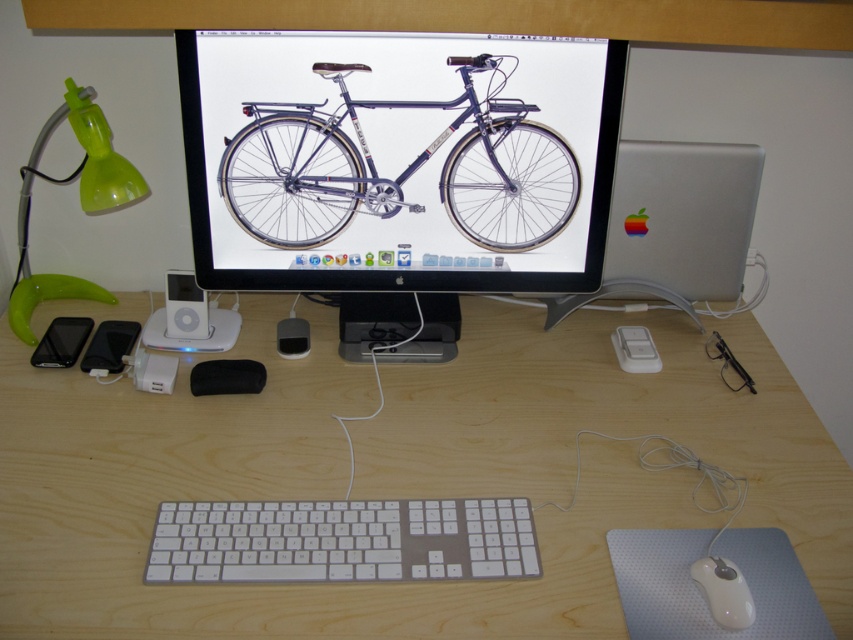
Consider the image. Between green translucent lamp at left and white glossy ipod at center, which one is positioned higher?

green translucent lamp at left

What do you see at coordinates (80, 204) in the screenshot? I see `green translucent lamp at left` at bounding box center [80, 204].

The height and width of the screenshot is (640, 853). What are the coordinates of `green translucent lamp at left` in the screenshot? It's located at coord(80,204).

Between white plastic keyboard at center and black matte phone at lower left, which one has less height?

white plastic keyboard at center is shorter.

At what (x,y) coordinates should I click in order to perform the action: click on white plastic keyboard at center. Please return your answer as a coordinate pair (x, y). The image size is (853, 640). Looking at the image, I should click on (341, 540).

I want to click on white plastic keyboard at center, so click(341, 540).

Which is above, metallic blue bicycle at center or matte black phone at lower left?

metallic blue bicycle at center

Between metallic blue bicycle at center and matte black phone at lower left, which one is positioned lower?

matte black phone at lower left

Locate an element on the screen. metallic blue bicycle at center is located at coordinates (399, 172).